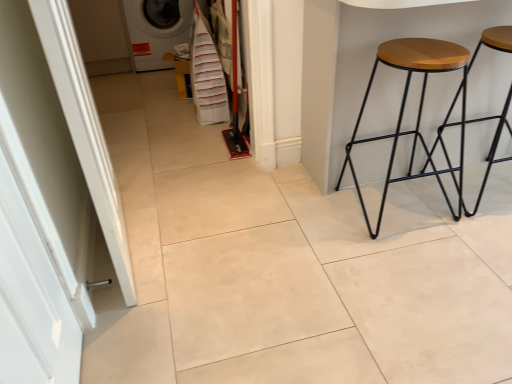
Question: Looking at their shapes, would you say white glossy door at left is wider or thinner than wooden stool at right?

Choices:
 (A) thin
 (B) wide

Answer: (A)

Question: Relative to wooden stool at right, is white glossy door at left in front or behind?

Choices:
 (A) behind
 (B) front

Answer: (B)

Question: Which is nearer to the wooden stool at right?

Choices:
 (A) white glossy door at left
 (B) white fabric laundry at center
 (C) wooden/black metal stool at right, which is counted as the 1th stool, starting from the left
 (D) white glossy washing machine at upper left
 (E) wooden seat stool at right, which ranks as the 1th stool in right-to-left order

Answer: (C)

Question: Which of these objects is positioned farthest from the white glossy washing machine at upper left?

Choices:
 (A) white fabric laundry at center
 (B) wooden stool at right
 (C) wooden seat stool at right, which appears as the second stool when viewed from the left
 (D) white glossy door at left
 (E) wooden/black metal stool at right, the 2th stool when ordered from right to left

Answer: (C)